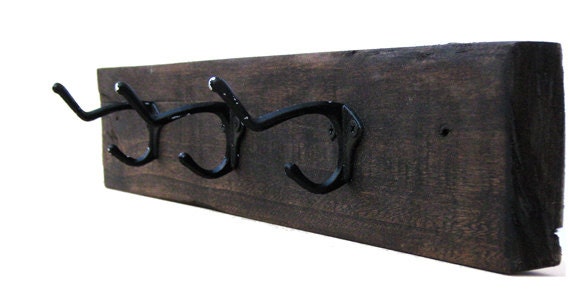
Find the location of a particular element. The image size is (570, 300). imperfection in side of wood is located at coordinates (556, 233).